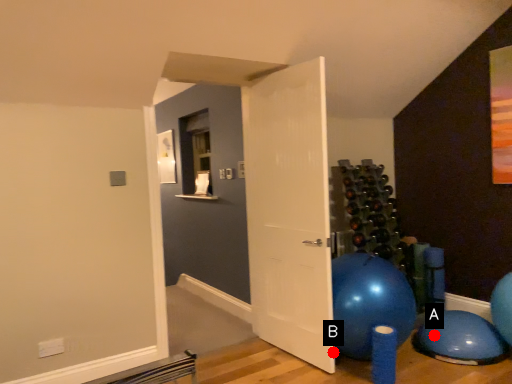
Question: Two points are circled on the image, labeled by A and B beside each circle. Which point is closer to the camera?

Choices:
 (A) A is closer
 (B) B is closer

Answer: (B)